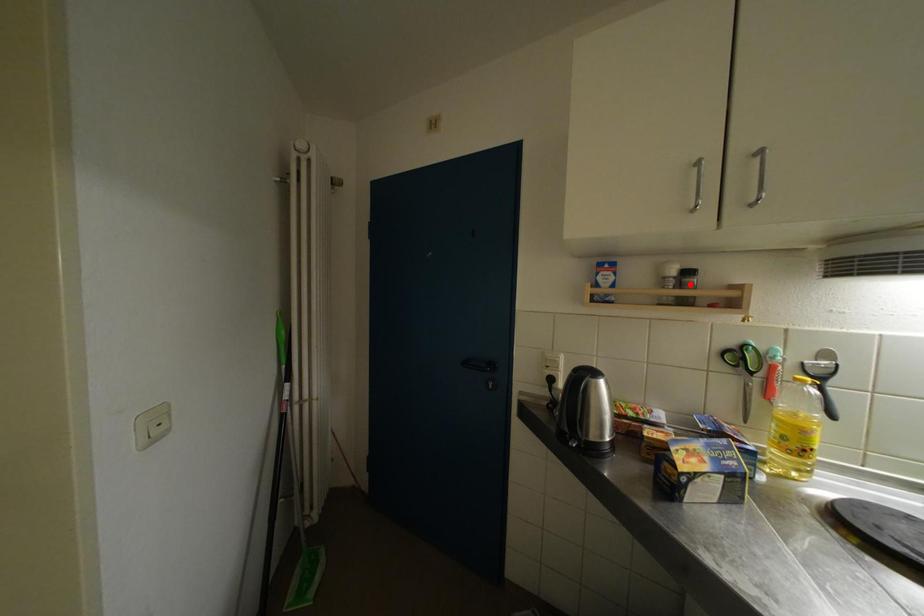
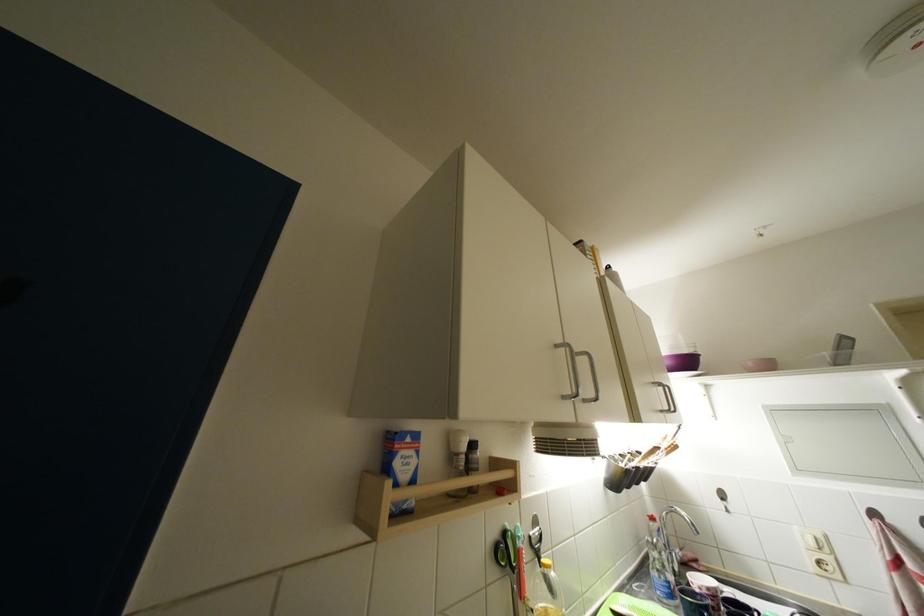
Where in the second image is the point corresponding to the highlighted location from the first image?

(478, 460)